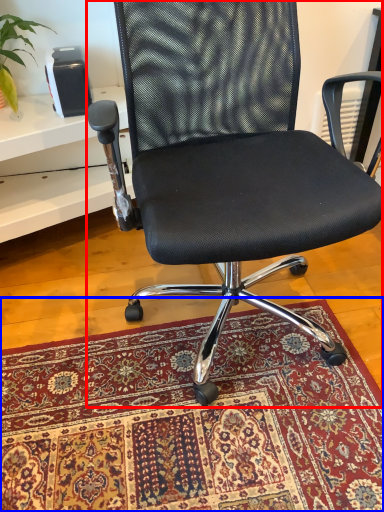
Question: Which object is further to the camera taking this photo, chair (highlighted by a red box) or mat (highlighted by a blue box)?

Choices:
 (A) chair
 (B) mat

Answer: (B)